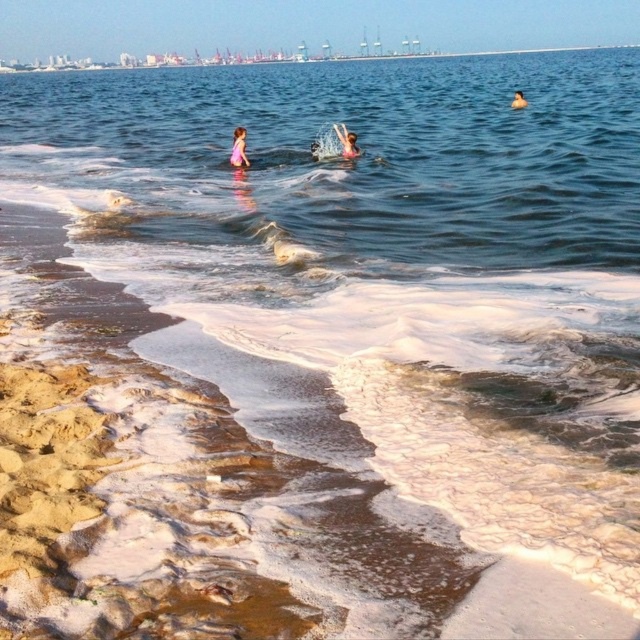
Question: Based on their relative distances, which object is nearer to the smooth skin person at upper center?

Choices:
 (A) pink fabric at center
 (B) pink fabric at upper center

Answer: (A)

Question: Is pink fabric at center smaller than smooth skin person at upper center?

Choices:
 (A) no
 (B) yes

Answer: (B)

Question: Is pink fabric at upper center above smooth skin person at upper center?

Choices:
 (A) yes
 (B) no

Answer: (B)

Question: Which of the following is the farthest from the observer?

Choices:
 (A) smooth skin person at upper center
 (B) pink fabric at center

Answer: (A)

Question: Considering the relative positions of pink fabric at upper center and pink fabric at center in the image provided, where is pink fabric at upper center located with respect to pink fabric at center?

Choices:
 (A) left
 (B) right

Answer: (A)

Question: Which object appears closest to the camera in this image?

Choices:
 (A) pink fabric at upper center
 (B) smooth skin person at upper center

Answer: (A)